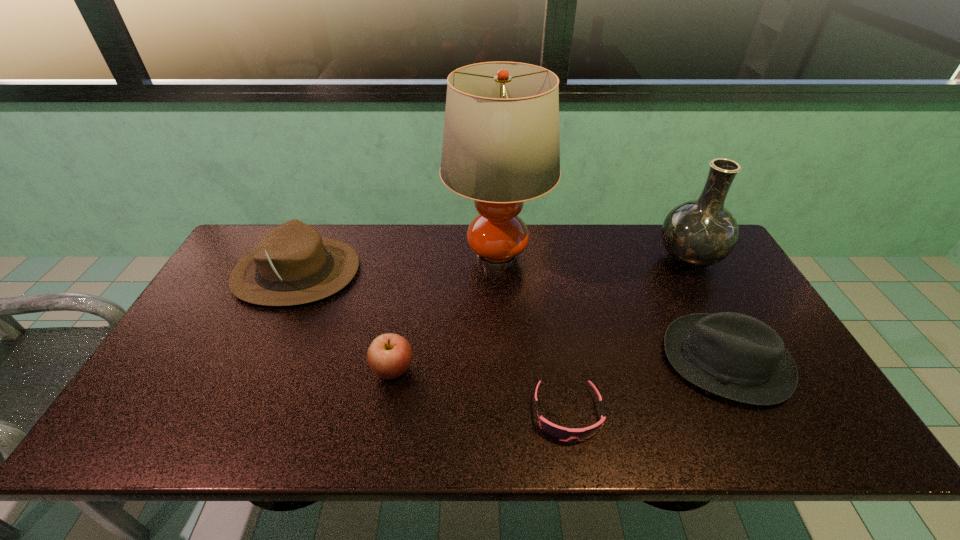
Where is `unoccupied position between the lamp and the shorter fedora`? The height and width of the screenshot is (540, 960). unoccupied position between the lamp and the shorter fedora is located at coordinates (612, 309).

The width and height of the screenshot is (960, 540). I want to click on free space between the lamp and the shorter fedora, so click(x=612, y=309).

Where is `empty space that is in between the second object from left to right and the lamp`? The height and width of the screenshot is (540, 960). empty space that is in between the second object from left to right and the lamp is located at coordinates (444, 313).

I want to click on vacant area that lies between the vase and the shorter fedora, so point(707,310).

Locate an element on the screen. Image resolution: width=960 pixels, height=540 pixels. the closest object relative to the goggles is located at coordinates (735, 356).

Find the location of `the third closest object to the lamp`. the third closest object to the lamp is located at coordinates (735, 356).

At what (x,y) coordinates should I click in order to perform the action: click on vacant space that satisfies the following two spatial constraints: 1. on the front side of the lamp; 2. on the feather side of the farther fedora. Please return your answer as a coordinate pair (x, y). This screenshot has height=540, width=960. Looking at the image, I should click on (497, 272).